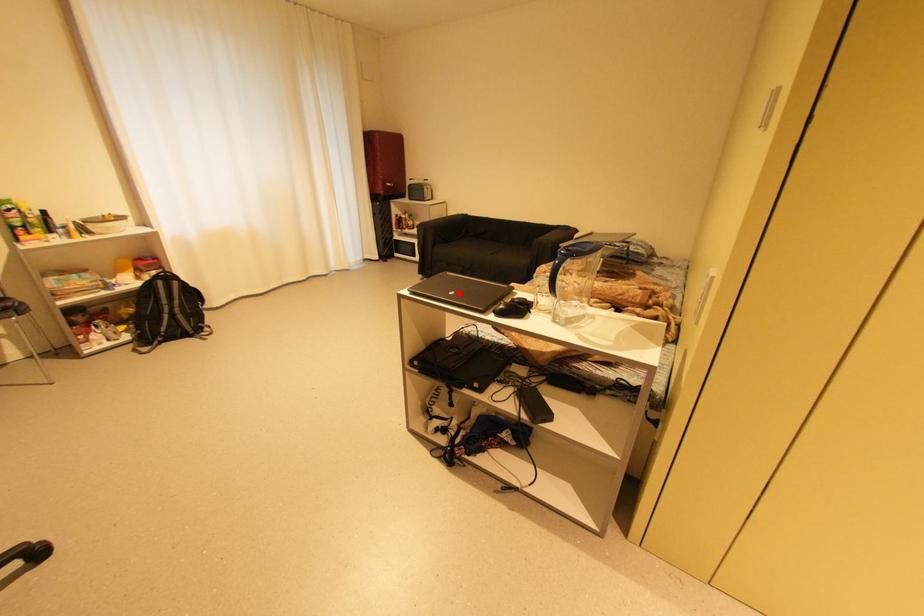
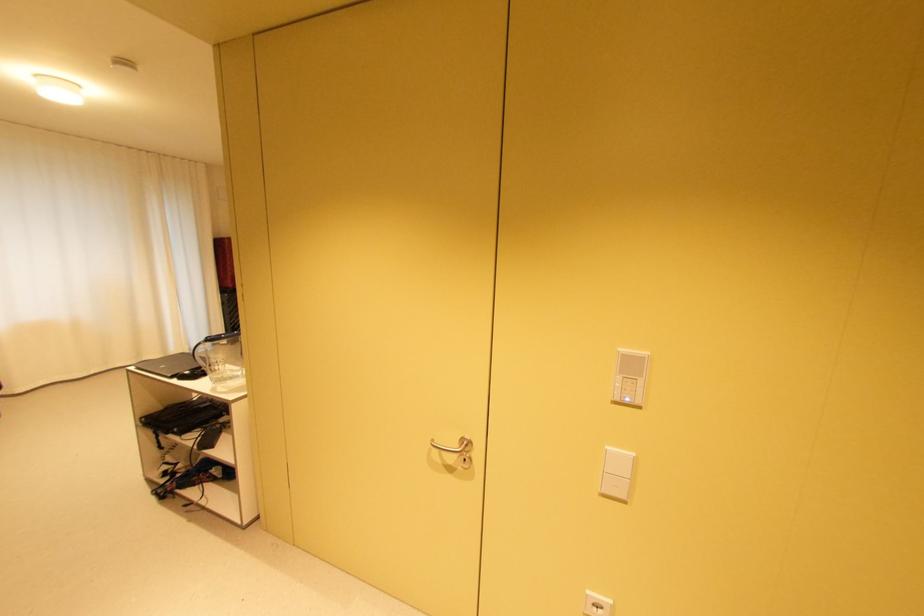
Where in the second image is the point corresponding to the highlighted location from the first image?

(171, 367)